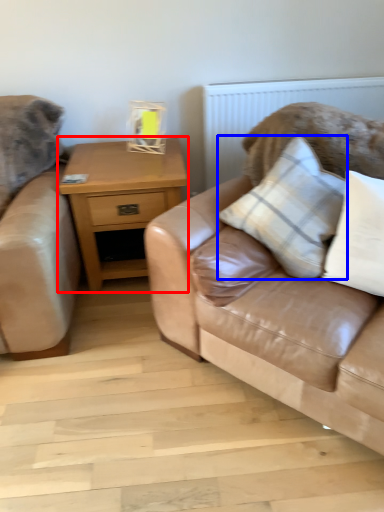
Question: Which point is closer to the camera, nightstand (highlighted by a red box) or pillow (highlighted by a blue box)?

Choices:
 (A) nightstand
 (B) pillow

Answer: (B)